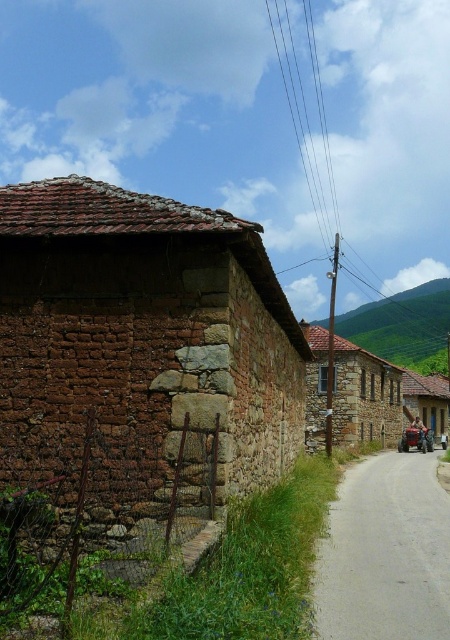
Question: Which point is farther to the camera?

Choices:
 (A) (439, 406)
 (B) (394, 388)

Answer: (A)

Question: Can you confirm if brown stone wall at left is smaller than rustic wooden cart at right?

Choices:
 (A) no
 (B) yes

Answer: (B)

Question: Which is farther from the brown stone wall at left?

Choices:
 (A) brown stone hut at center
 (B) rustic wooden cart at right

Answer: (B)

Question: Can you confirm if brown stone wall at left is bigger than rustic wooden cart at right?

Choices:
 (A) yes
 (B) no

Answer: (B)

Question: Among these points, which one is nearest to the camera?

Choices:
 (A) (409, 372)
 (B) (72, 378)

Answer: (B)

Question: Can you confirm if brown stone wall at left is wider than brown stone hut at center?

Choices:
 (A) no
 (B) yes

Answer: (A)